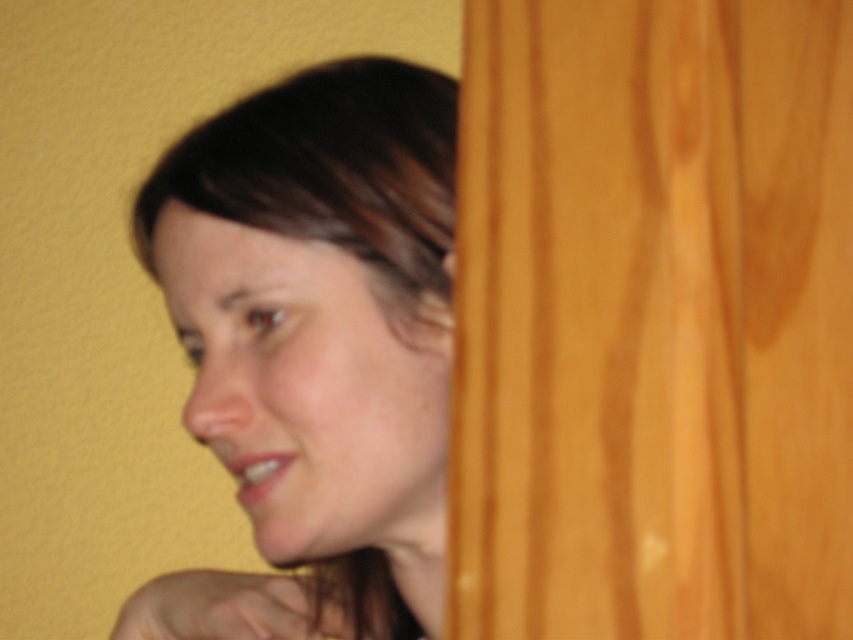
Question: Which point is closer to the camera?

Choices:
 (A) (305, 480)
 (B) (227, 140)

Answer: (A)

Question: Does matte skin face at center lie behind dark brown hair at upper left?

Choices:
 (A) yes
 (B) no

Answer: (B)

Question: Among these points, which one is nearest to the camera?

Choices:
 (A) (282, 557)
 (B) (434, 132)

Answer: (A)

Question: Which point is closer to the camera taking this photo?

Choices:
 (A) (213, 132)
 (B) (143, 227)

Answer: (A)

Question: Can you confirm if matte skin face at center is positioned to the left of dark brown hair at upper left?

Choices:
 (A) no
 (B) yes

Answer: (A)

Question: Is matte skin face at center further to the viewer compared to dark brown hair at upper left?

Choices:
 (A) no
 (B) yes

Answer: (A)